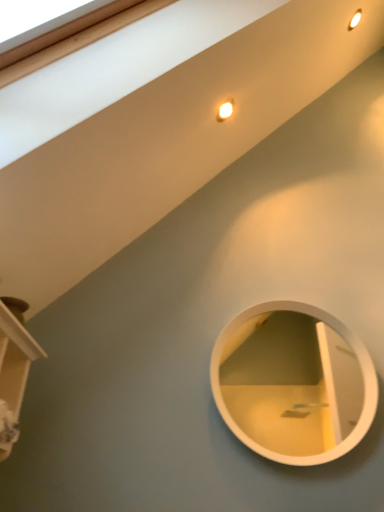
Question: Considering the relative positions of white glossy mirror at center and wooden shelf at lower left in the image provided, is white glossy mirror at center behind wooden shelf at lower left?

Choices:
 (A) yes
 (B) no

Answer: (A)

Question: From a real-world perspective, is white glossy mirror at center located higher than wooden shelf at lower left?

Choices:
 (A) no
 (B) yes

Answer: (B)

Question: Can wooden shelf at lower left be found inside white glossy mirror at center?

Choices:
 (A) yes
 (B) no

Answer: (B)

Question: Considering the relative sizes of white glossy mirror at center and wooden shelf at lower left in the image provided, is white glossy mirror at center smaller than wooden shelf at lower left?

Choices:
 (A) yes
 (B) no

Answer: (A)

Question: From the image's perspective, is white glossy mirror at center on wooden shelf at lower left?

Choices:
 (A) no
 (B) yes

Answer: (A)

Question: Is white glossy mirror at center outside of wooden shelf at lower left?

Choices:
 (A) no
 (B) yes

Answer: (B)

Question: From a real-world perspective, is wooden shelf at lower left over white glossy mirror at center?

Choices:
 (A) yes
 (B) no

Answer: (B)

Question: Can you confirm if wooden shelf at lower left is thinner than white glossy mirror at center?

Choices:
 (A) no
 (B) yes

Answer: (A)

Question: From a real-world perspective, is wooden shelf at lower left below white glossy mirror at center?

Choices:
 (A) no
 (B) yes

Answer: (B)

Question: Is wooden shelf at lower left further to camera compared to white glossy mirror at center?

Choices:
 (A) yes
 (B) no

Answer: (B)

Question: Does wooden shelf at lower left have a greater width compared to white glossy mirror at center?

Choices:
 (A) yes
 (B) no

Answer: (A)

Question: Does wooden shelf at lower left touch white glossy mirror at center?

Choices:
 (A) no
 (B) yes

Answer: (A)

Question: Considering the positions of wooden shelf at lower left and white glossy mirror at center in the image, is wooden shelf at lower left taller or shorter than white glossy mirror at center?

Choices:
 (A) tall
 (B) short

Answer: (B)